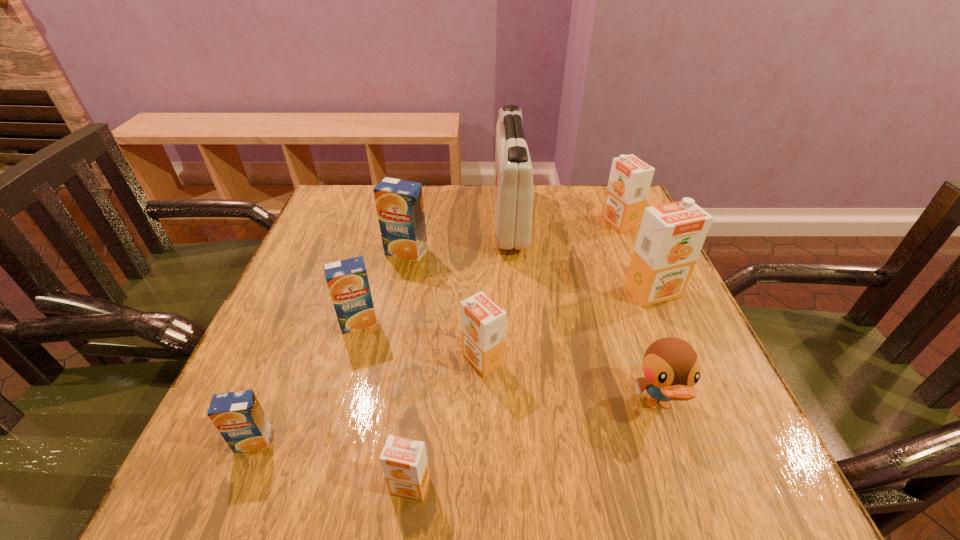
Locate an element on the screen. This screenshot has height=540, width=960. the third biggest orange orange juice is located at coordinates (483, 323).

Find the location of a particular element. the third orange orange juice from right to left is located at coordinates (483, 323).

What are the coordinates of `blue duck` in the screenshot? It's located at (671, 367).

At what (x,y) coordinates should I click in order to perform the action: click on the leftmost object. Please return your answer as a coordinate pair (x, y). This screenshot has width=960, height=540. Looking at the image, I should click on (238, 416).

At what (x,y) coordinates should I click in order to perform the action: click on the leftmost orange juice. Please return your answer as a coordinate pair (x, y). The height and width of the screenshot is (540, 960). Looking at the image, I should click on (238, 416).

The image size is (960, 540). I want to click on the nearest object, so click(404, 462).

Locate an element on the screen. The image size is (960, 540). the leftmost orange orange juice is located at coordinates coord(404,462).

The height and width of the screenshot is (540, 960). Identify the location of free space located 0.070m on the front side of the first-aid kit. (468, 218).

At what (x,y) coordinates should I click in order to perform the action: click on free space located 0.290m on the front side of the first-aid kit. Please return your answer as a coordinate pair (x, y). The width and height of the screenshot is (960, 540). Looking at the image, I should click on (385, 218).

Locate an element on the screen. The image size is (960, 540). vacant space situated 0.230m on the front side of the first-aid kit is located at coordinates (408, 218).